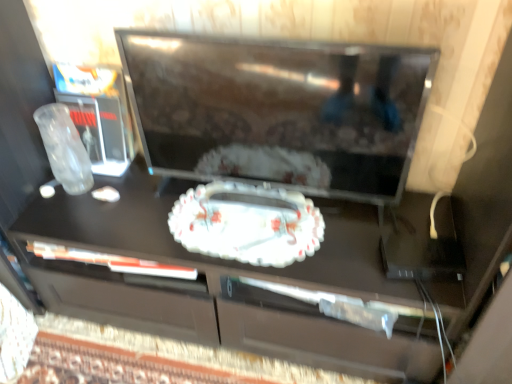
Question: Considering the positions of porcelain floral tray at center and matte black tv at center in the image, is porcelain floral tray at center bigger or smaller than matte black tv at center?

Choices:
 (A) big
 (B) small

Answer: (B)

Question: From a real-world perspective, is porcelain floral tray at center above or below matte black tv at center?

Choices:
 (A) below
 (B) above

Answer: (A)

Question: Is porcelain floral tray at center in front of or behind matte black tv at center in the image?

Choices:
 (A) front
 (B) behind

Answer: (B)

Question: Is matte black tv at center taller or shorter than porcelain floral tray at center?

Choices:
 (A) tall
 (B) short

Answer: (A)

Question: Is matte black tv at center wider or thinner than porcelain floral tray at center?

Choices:
 (A) thin
 (B) wide

Answer: (A)

Question: From a real-world perspective, relative to porcelain floral tray at center, is matte black tv at center vertically above or below?

Choices:
 (A) below
 (B) above

Answer: (B)

Question: Looking at the image, does matte black tv at center seem bigger or smaller compared to porcelain floral tray at center?

Choices:
 (A) small
 (B) big

Answer: (B)